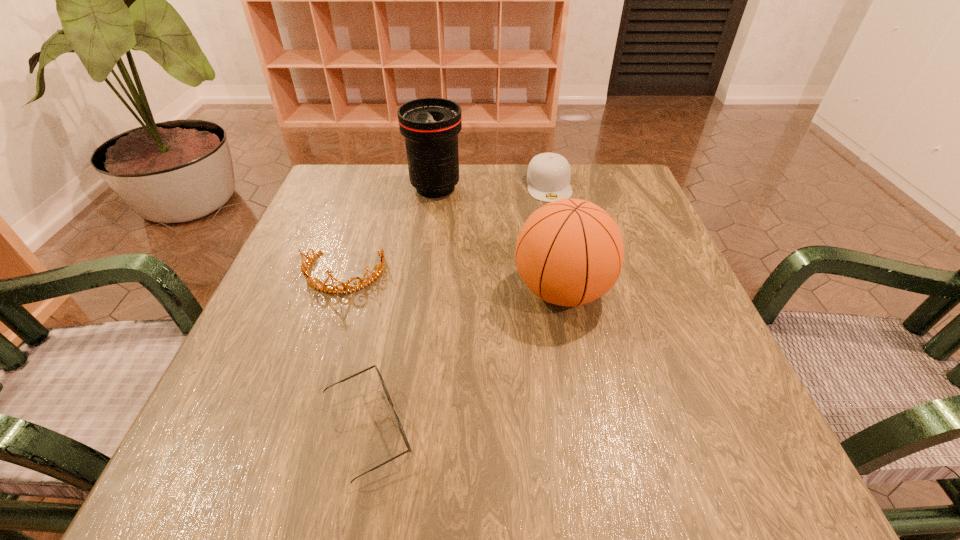
The image size is (960, 540). What are the coordinates of `telephoto lens` in the screenshot? It's located at (430, 126).

Where is `basketball`? The width and height of the screenshot is (960, 540). basketball is located at coordinates (569, 252).

This screenshot has height=540, width=960. I want to click on cap, so click(x=548, y=177).

Identify the location of tiara. The height and width of the screenshot is (540, 960). (346, 288).

Identify the location of the shortest object. Image resolution: width=960 pixels, height=540 pixels. (379, 375).

Identify the location of the nearest object. This screenshot has width=960, height=540. (379, 375).

Identify the location of free space located 0.120m on the left of the telephoto lens. (360, 188).

Locate an element on the screen. The height and width of the screenshot is (540, 960). vacant region located on the back of the basketball is located at coordinates (540, 174).

At what (x,y) coordinates should I click in order to perform the action: click on vacant area located on the front-facing side of the cap. Please return your answer as a coordinate pair (x, y). This screenshot has width=960, height=540. Looking at the image, I should click on (556, 219).

This screenshot has height=540, width=960. Find the location of `vacant region located 0.290m on the front-facing side of the tiara`. vacant region located 0.290m on the front-facing side of the tiara is located at coordinates (286, 445).